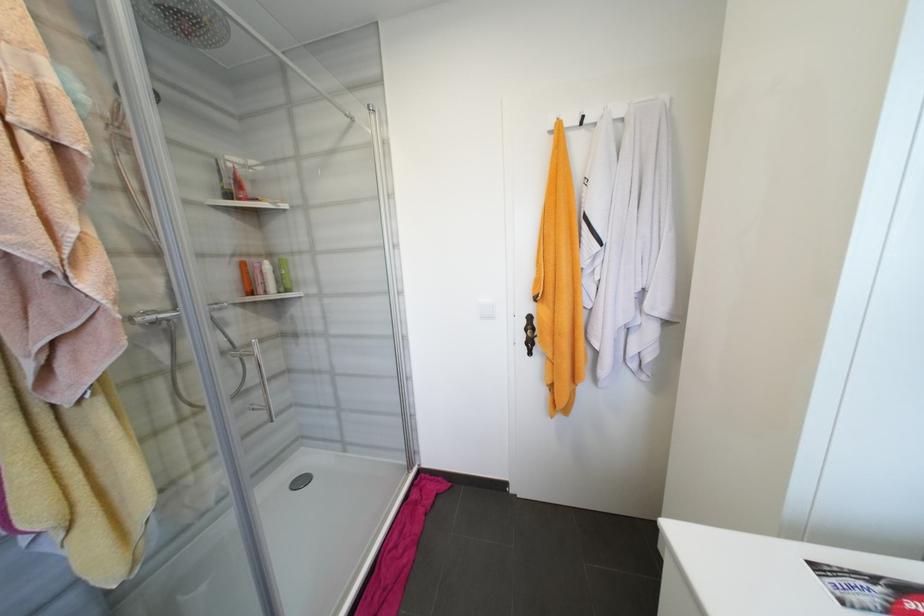
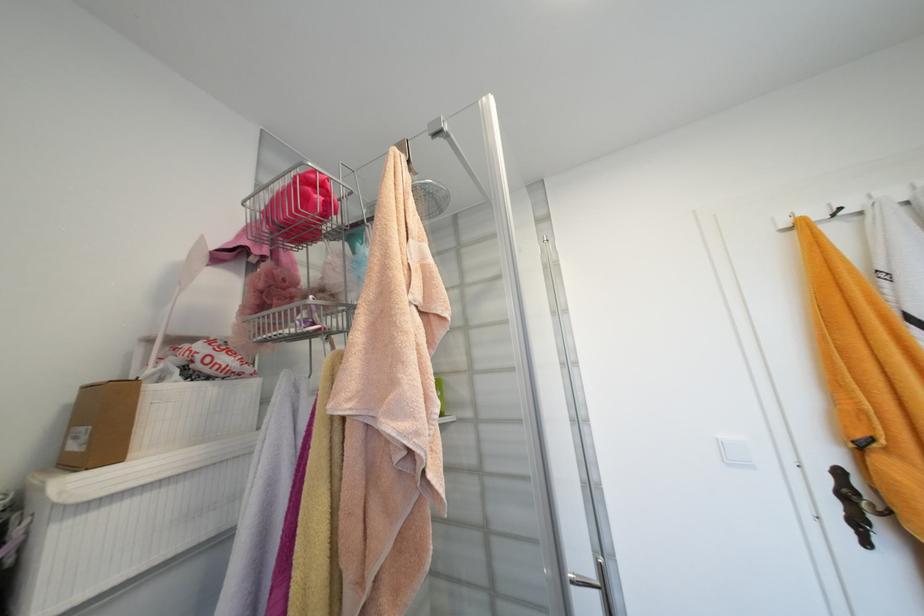
In the second image, find the point that corresponds to point 557,128 in the first image.

(792, 225)